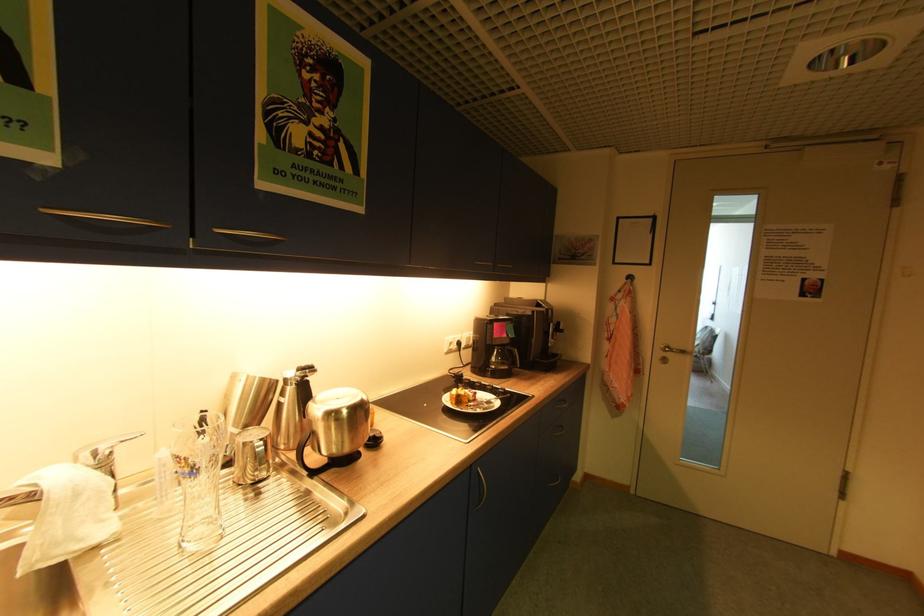
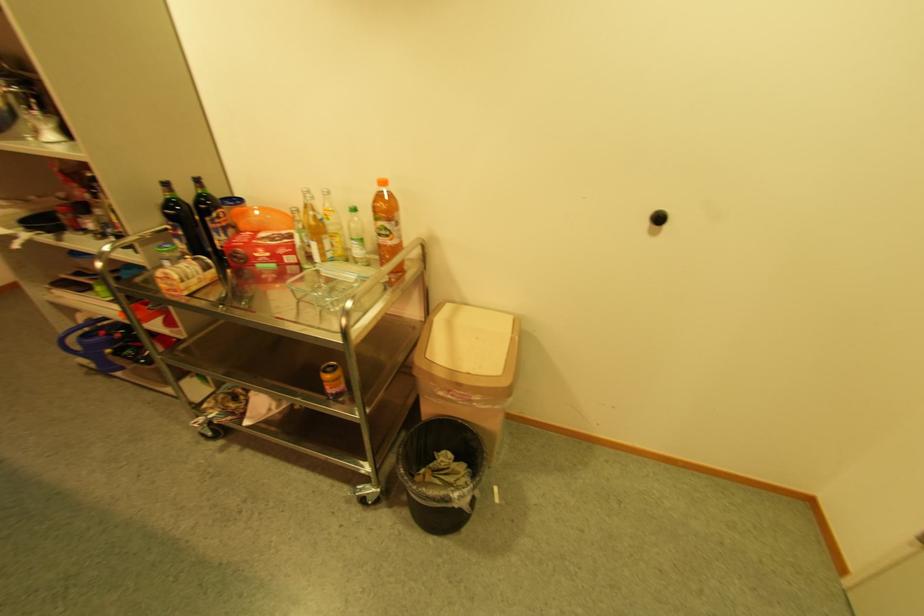
The first image is from the beginning of the video and the second image is from the end. How did the camera likely rotate when shooting the video?

The rotation direction of the camera is right-down.